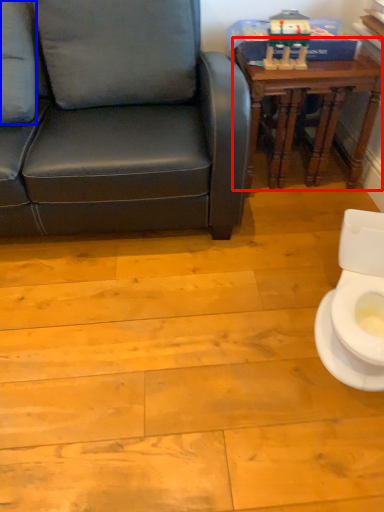
Question: Which object is further to the camera taking this photo, table (highlighted by a red box) or pillow (highlighted by a blue box)?

Choices:
 (A) table
 (B) pillow

Answer: (A)